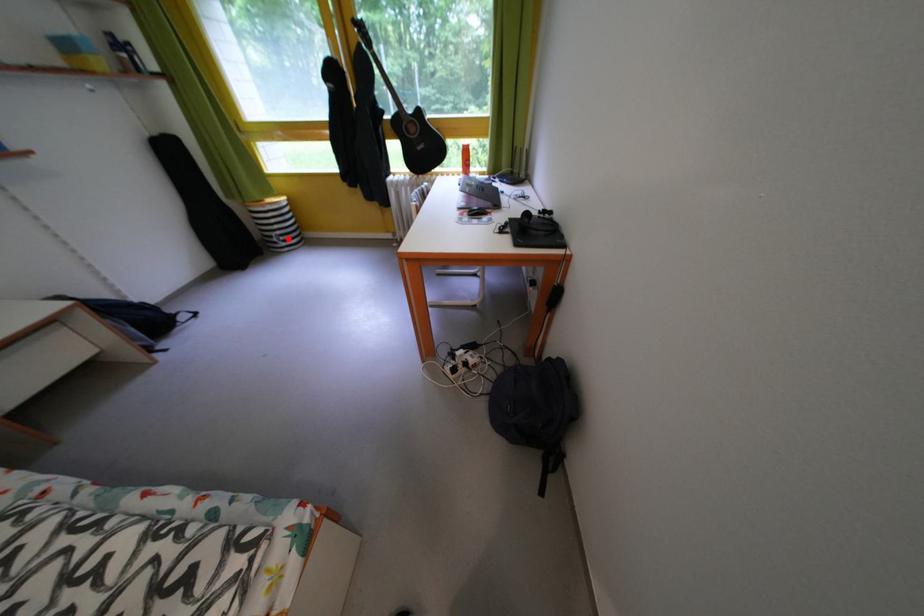
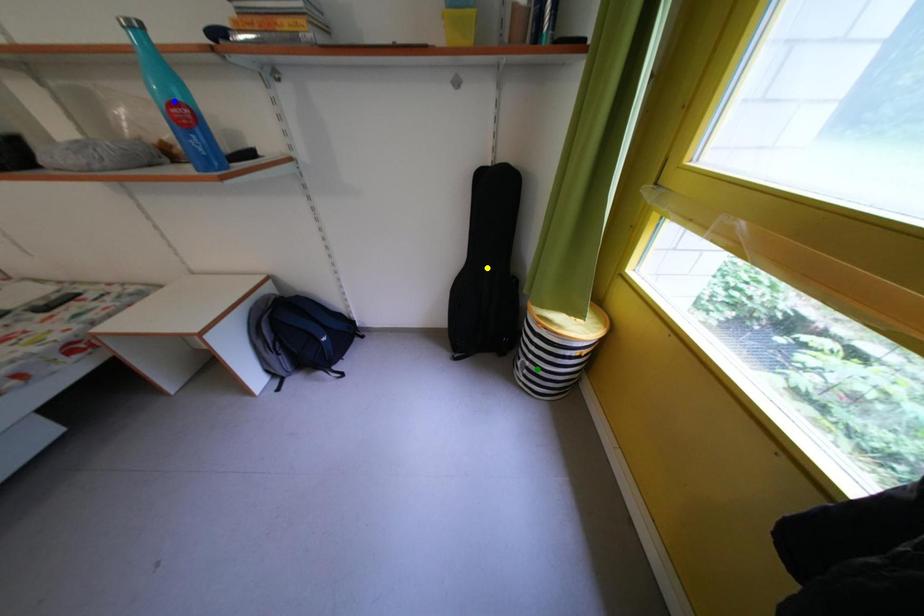
Question: I am providing you with two images of the same scene from different viewpoints. A red point is marked on the first image. You are given multiple points on the second image. Can you choose the point in image 2 that corresponds to the point in image 1?

Choices:
 (A) blue point
 (B) green point
 (C) yellow point

Answer: (B)